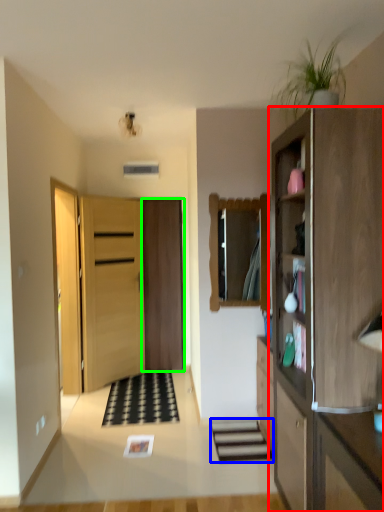
Question: Considering the real-world distances, which object is closest to cabinetry (highlighted by a red box)? stairwell (highlighted by a blue box) or door (highlighted by a green box).

Choices:
 (A) stairwell
 (B) door

Answer: (A)